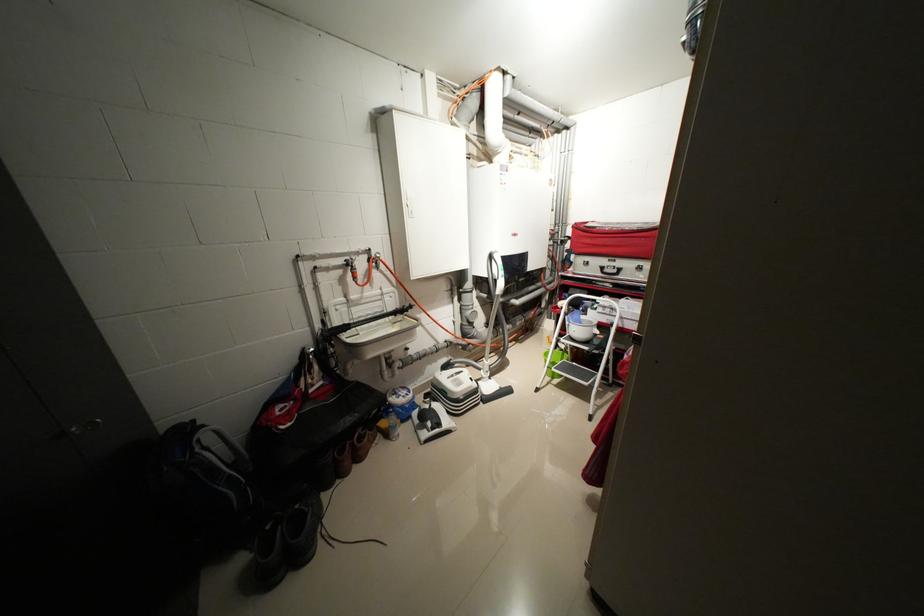
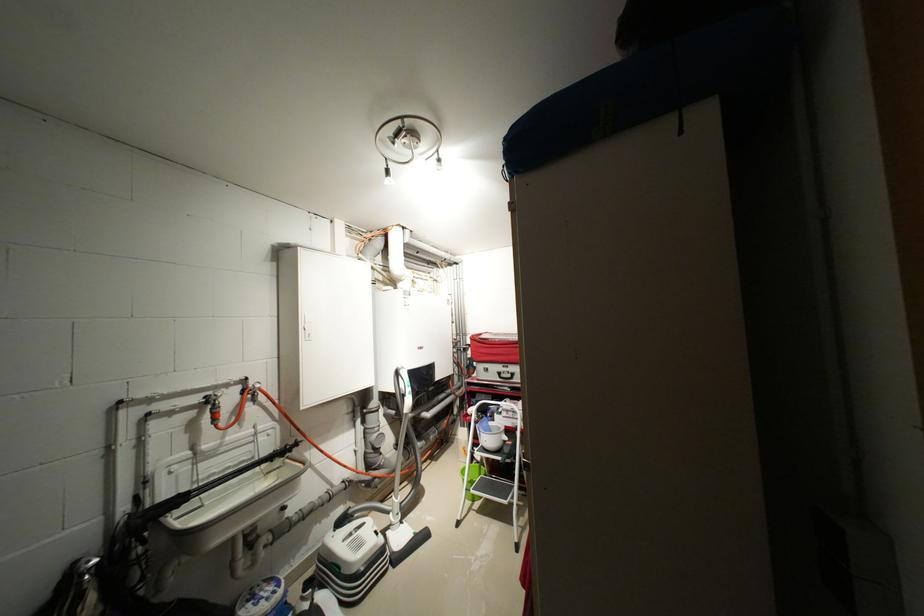
Question: I am providing you with two images of the same scene from different viewpoints. After the viewpoint changes to image2, which objects are now occluded?

Choices:
 (A) sprayer wand trigger
 (B) white bucket handle
 (C) step stool handle
 (D) none of these

Answer: (D)